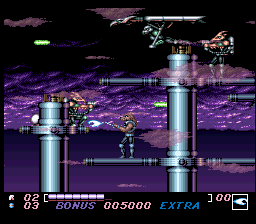
This screenshot has height=224, width=256. Find the location of `floor`. floor is located at coordinates (119, 162).